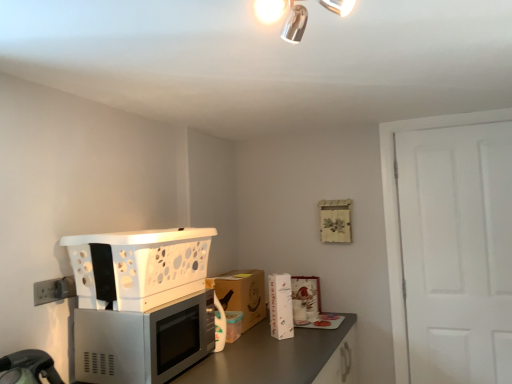
Question: In terms of size, does metallic chrome light fixture at upper center appear bigger or smaller than white plastic basket at left?

Choices:
 (A) big
 (B) small

Answer: (B)

Question: From the image's perspective, relative to white plastic basket at left, is metallic chrome light fixture at upper center above or below?

Choices:
 (A) above
 (B) below

Answer: (A)

Question: Which object is the farthest from the metallic chrome light fixture at upper center?

Choices:
 (A) satin silver microwave at lower left
 (B) white plastic electric outlet at lower left
 (C) white glossy refrigerator at center, arranged as the second appliance when viewed from the right
 (D) white plastic basket at left
 (E) matte white picture frame at center, positioned as the 1th appliance in right-to-left order

Answer: (E)

Question: Which is nearer to the satin silver microwave at lower left?

Choices:
 (A) white plastic basket at left
 (B) brown cardboard box at center
 (C) metallic gray countertop at lower center
 (D) white glossy refrigerator at center, marked as the first appliance in a front-to-back arrangement
 (E) matte white picture frame at center, positioned as the 1th appliance in right-to-left order

Answer: (A)